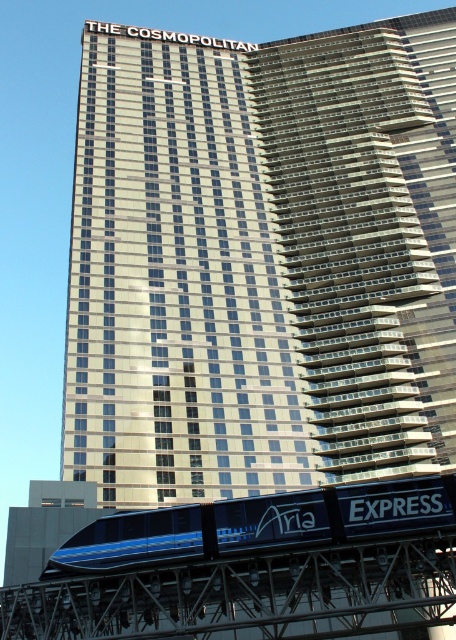
From the picture: Is glassy silver skyscraper at center further to camera compared to blue glossy monorail at lower center?

Yes, it is.

Between point (139, 442) and point (139, 512), which one is positioned behind?

Positioned behind is point (139, 442).

Measure the distance between glassy silver skyscraper at center and camera.

The distance of glassy silver skyscraper at center from camera is 56.58 meters.

Locate an element on the screen. The height and width of the screenshot is (640, 456). glassy silver skyscraper at center is located at coordinates (262, 260).